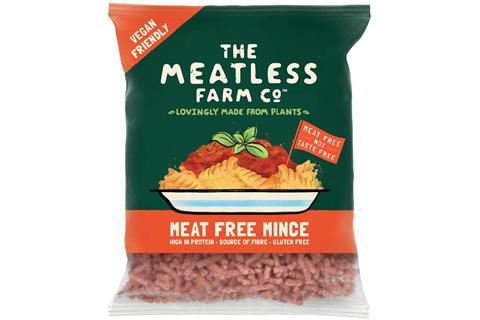
Identify the location of illustrated plate. The image size is (480, 320). (247, 203).